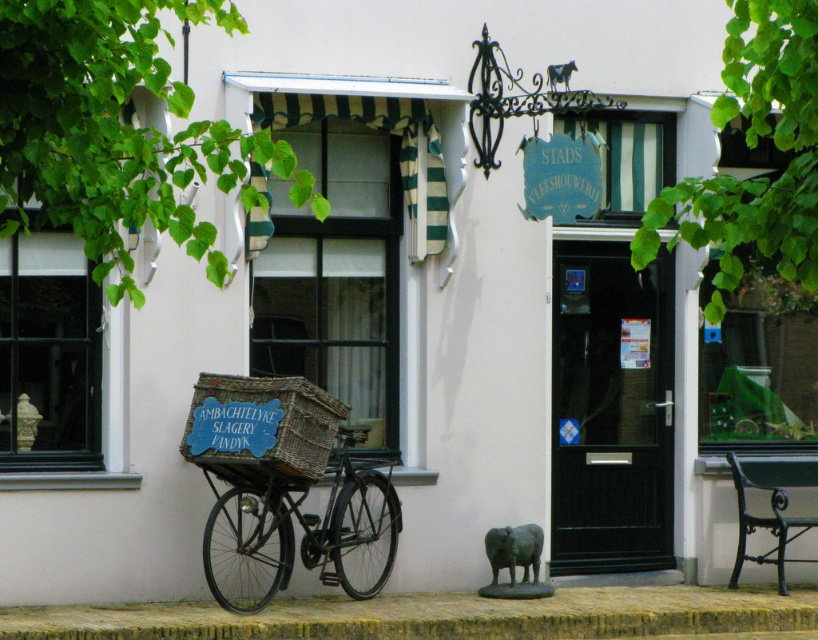
Question: Which of the following is the closest to the observer?

Choices:
 (A) (223, 384)
 (B) (396, 620)
 (C) (324, 566)

Answer: (B)

Question: Does black matte bicycle at center have a lesser width compared to woven brown crate at center?

Choices:
 (A) no
 (B) yes

Answer: (A)

Question: Which point is farther to the camera?

Choices:
 (A) brick at lower center
 (B) woven brown crate at center

Answer: (B)

Question: Is brick at lower center smaller than woven brown crate at center?

Choices:
 (A) yes
 (B) no

Answer: (B)

Question: Does brick at lower center have a smaller size compared to woven brown crate at center?

Choices:
 (A) yes
 (B) no

Answer: (B)

Question: Considering the real-world distances, which object is farthest from the brick at lower center?

Choices:
 (A) black matte bicycle at center
 (B) woven brown crate at center

Answer: (B)